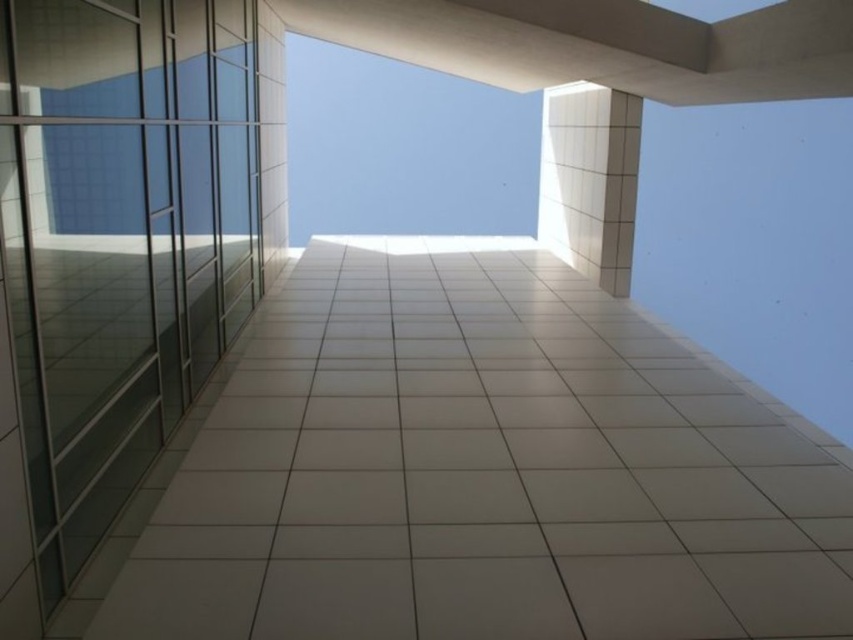
Question: Which object is farther from the camera taking this photo?

Choices:
 (A) transparent glass elevator at left
 (B) white tile pillar at upper right

Answer: (B)

Question: Is transparent glass elevator at left further to camera compared to white tile pillar at upper right?

Choices:
 (A) yes
 (B) no

Answer: (B)

Question: Which point is farther from the camera taking this photo?

Choices:
 (A) (33, 298)
 (B) (595, 200)

Answer: (B)

Question: Is transparent glass elevator at left bigger than white tile pillar at upper right?

Choices:
 (A) no
 (B) yes

Answer: (A)

Question: Observing the image, what is the correct spatial positioning of transparent glass elevator at left in reference to white tile pillar at upper right?

Choices:
 (A) left
 (B) right

Answer: (A)

Question: Which object is farther from the camera taking this photo?

Choices:
 (A) transparent glass elevator at left
 (B) white tile pillar at upper right

Answer: (B)